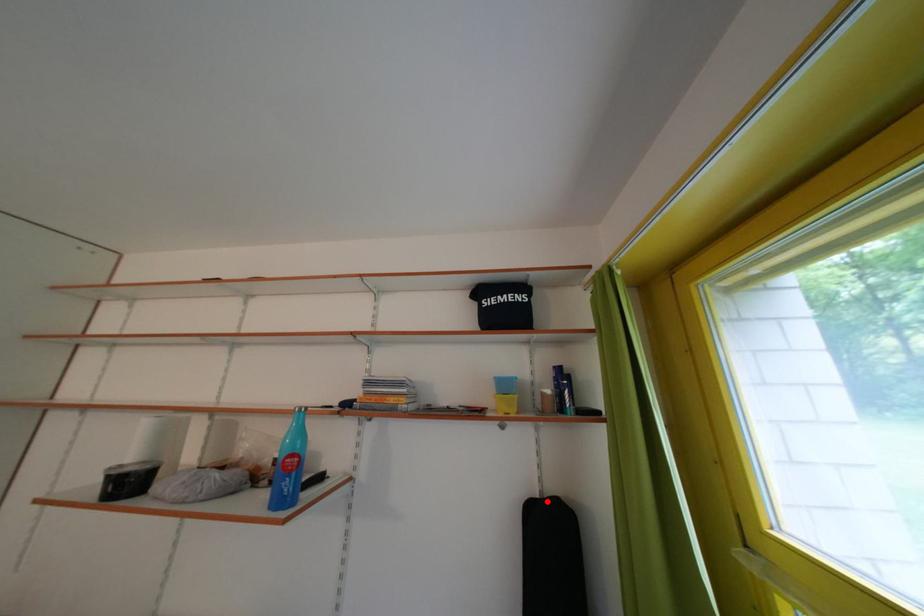
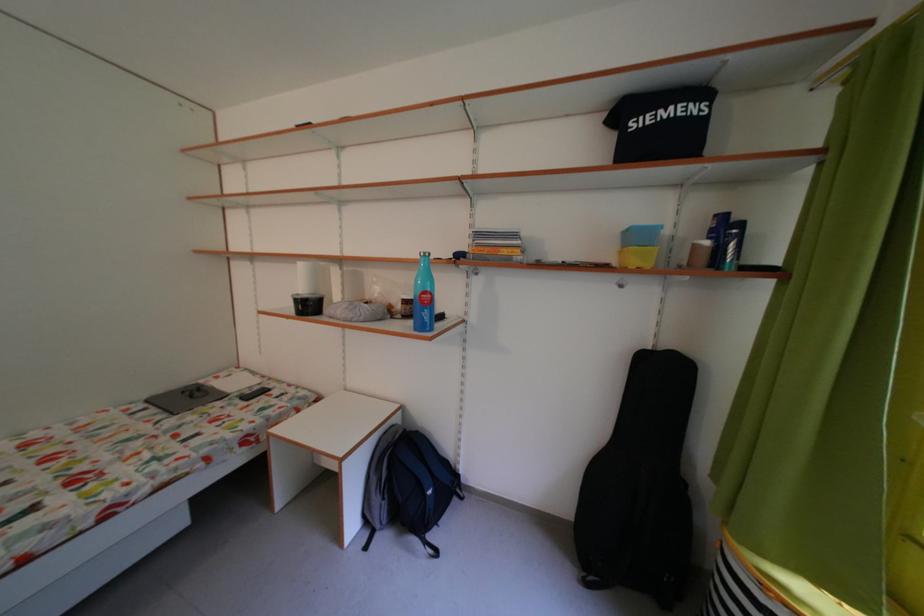
Question: A red point is marked in image1. In image2, is the corresponding 3D point closer to the camera or farther? Reply with the corresponding letter.

Choices:
 (A) The corresponding 3D point is closer.
 (B) The corresponding 3D point is farther.

Answer: (A)